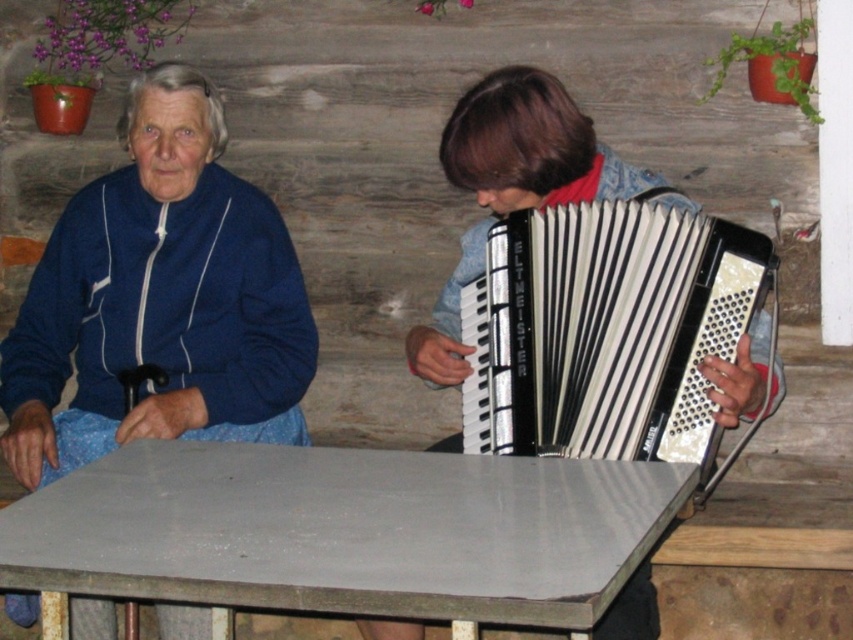
Question: Which is nearer to the metallic accordion at center?

Choices:
 (A) black plastic accordion at right
 (B) smooth gray table at center

Answer: (A)

Question: Does smooth gray table at center appear over black plastic accordion at right?

Choices:
 (A) no
 (B) yes

Answer: (A)

Question: Which point is farther to the camera?

Choices:
 (A) black plastic accordion at right
 (B) blue fabric at left
 (C) metallic accordion at center

Answer: (B)

Question: Which of the following is the closest to the observer?

Choices:
 (A) (544, 161)
 (B) (144, 435)
 (C) (573, 342)
 (D) (508, 593)

Answer: (D)

Question: Is blue fabric at left bigger than metallic accordion at center?

Choices:
 (A) yes
 (B) no

Answer: (A)

Question: Can you confirm if smooth gray table at center is wider than metallic accordion at center?

Choices:
 (A) no
 (B) yes

Answer: (B)